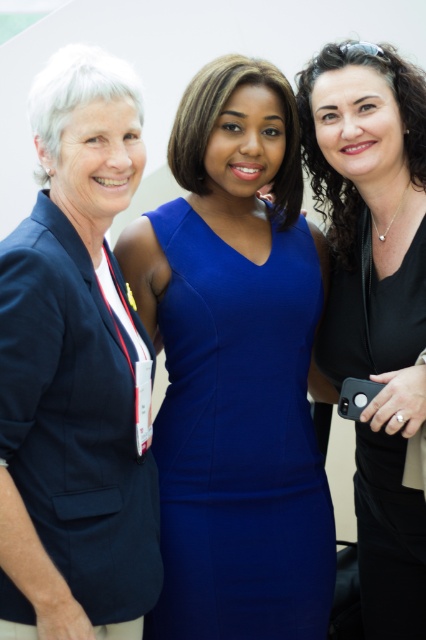
Question: Which object is positioned closest to the royal blue jersey dress at center?

Choices:
 (A) black matte dress at center
 (B) matte black blazer at left

Answer: (A)

Question: Can you confirm if matte black blazer at left is bigger than royal blue jersey dress at center?

Choices:
 (A) yes
 (B) no

Answer: (B)

Question: Is royal blue jersey dress at center to the left of black matte dress at center from the viewer's perspective?

Choices:
 (A) no
 (B) yes

Answer: (B)

Question: Which object is farther from the camera taking this photo?

Choices:
 (A) black matte dress at center
 (B) matte black blazer at left

Answer: (A)

Question: Is matte black blazer at left above black matte dress at center?

Choices:
 (A) yes
 (B) no

Answer: (A)

Question: Which object is farther from the camera taking this photo?

Choices:
 (A) matte black blazer at left
 (B) black matte dress at center
 (C) royal blue jersey dress at center

Answer: (C)